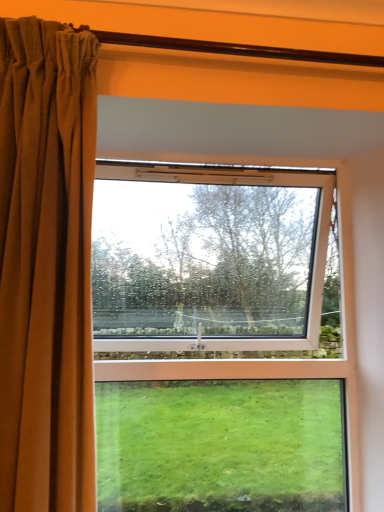
Question: Is the depth of brown velvet curtain at left less than that of clear glass window at center?

Choices:
 (A) yes
 (B) no

Answer: (A)

Question: Considering the relative sizes of brown velvet curtain at left and clear glass window at center in the image provided, is brown velvet curtain at left shorter than clear glass window at center?

Choices:
 (A) no
 (B) yes

Answer: (B)

Question: Is brown velvet curtain at left smaller than clear glass window at center?

Choices:
 (A) no
 (B) yes

Answer: (B)

Question: Is brown velvet curtain at left to the right of clear glass window at center from the viewer's perspective?

Choices:
 (A) no
 (B) yes

Answer: (A)

Question: Is brown velvet curtain at left positioned with its back to clear glass window at center?

Choices:
 (A) no
 (B) yes

Answer: (A)

Question: From a real-world perspective, is brown velvet curtain at left over clear glass window at center?

Choices:
 (A) yes
 (B) no

Answer: (A)

Question: From a real-world perspective, is clear glass window at center located higher than brown velvet curtain at left?

Choices:
 (A) yes
 (B) no

Answer: (B)

Question: Is clear glass window at center placed right next to brown velvet curtain at left?

Choices:
 (A) yes
 (B) no

Answer: (B)

Question: Can you confirm if clear glass window at center is bigger than brown velvet curtain at left?

Choices:
 (A) yes
 (B) no

Answer: (A)

Question: Is brown velvet curtain at left surrounded by clear glass window at center?

Choices:
 (A) yes
 (B) no

Answer: (B)

Question: Considering the relative sizes of clear glass window at center and brown velvet curtain at left in the image provided, is clear glass window at center wider than brown velvet curtain at left?

Choices:
 (A) yes
 (B) no

Answer: (A)

Question: Does clear glass window at center appear on the left side of brown velvet curtain at left?

Choices:
 (A) yes
 (B) no

Answer: (B)

Question: In terms of size, does brown velvet curtain at left appear bigger or smaller than clear glass window at center?

Choices:
 (A) big
 (B) small

Answer: (B)